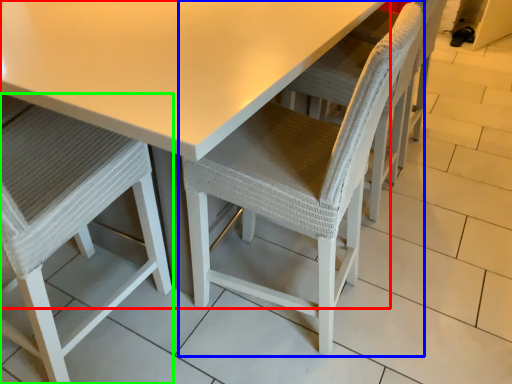
Question: Which is nearer to the table (highlighted by a red box)? chair (highlighted by a blue box) or chair (highlighted by a green box).

Choices:
 (A) chair
 (B) chair

Answer: (A)